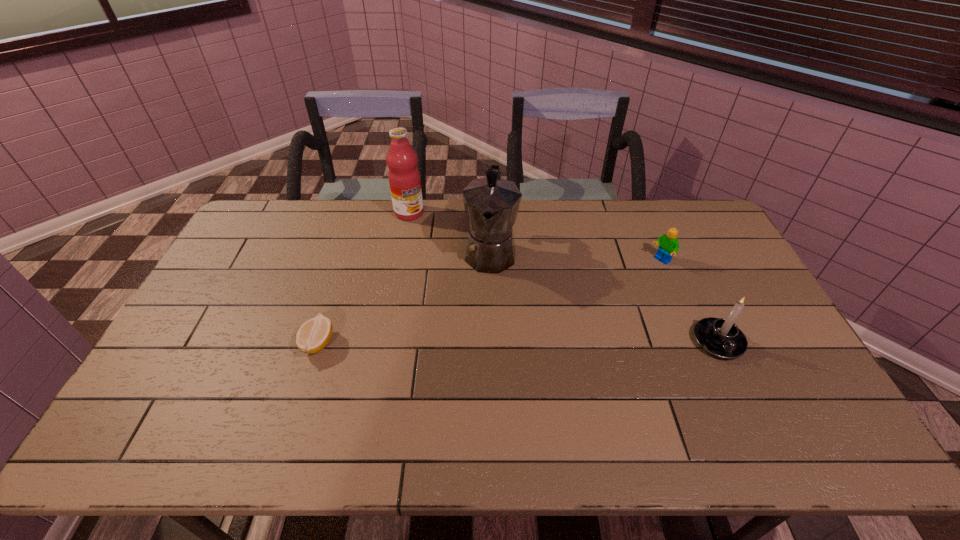
In order to click on the leftmost object in this screenshot , I will do `click(313, 336)`.

The height and width of the screenshot is (540, 960). Find the location of `lemon`. lemon is located at coordinates [x=313, y=336].

Image resolution: width=960 pixels, height=540 pixels. I want to click on candle holder, so click(720, 337).

Locate an element on the screen. the third object from right to left is located at coordinates (491, 204).

Where is `the second shortest object`? Image resolution: width=960 pixels, height=540 pixels. the second shortest object is located at coordinates [669, 245].

I want to click on the farthest object, so click(404, 178).

You are a GUI agent. You are given a task and a screenshot of the screen. Output one action in this format:
    pyautogui.click(x=<x>, y=<y>)
    Task: Click on the fruit juice
    
    Given the screenshot: What is the action you would take?
    pyautogui.click(x=404, y=178)

At what (x,y) coordinates should I click in order to perform the action: click on vacant area located 0.300m on the back of the leftmost object. Please return your answer as a coordinate pair (x, y). This screenshot has height=540, width=960. Looking at the image, I should click on point(347,255).

At what (x,y) coordinates should I click in order to perform the action: click on free space located 0.110m with a handle on the side of the candle holder. Please return your answer as a coordinate pair (x, y). This screenshot has height=540, width=960. Looking at the image, I should click on (745, 399).

The width and height of the screenshot is (960, 540). Find the location of `free space located 0.320m on the pouring side of the third object from left to right`. free space located 0.320m on the pouring side of the third object from left to right is located at coordinates (477, 367).